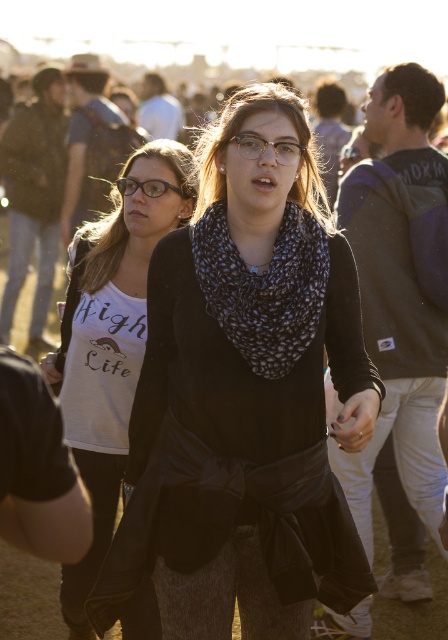
Question: Which object is farther from the camera taking this photo?

Choices:
 (A) black matte scarf at center
 (B) clear plastic glasses at center
 (C) matte black glasses at center

Answer: (C)

Question: Which of the following is the closest to the observer?

Choices:
 (A) (302, 148)
 (B) (120, 464)
 (C) (244, 352)
 (D) (177, 192)

Answer: (C)

Question: Which point is farther to the camera?

Choices:
 (A) (121, 184)
 (B) (271, 314)

Answer: (A)

Question: Can you confirm if black dotted scarf at center is thinner than matte black glasses at center?

Choices:
 (A) no
 (B) yes

Answer: (A)

Question: Is black dotted scarf at center smaller than clear plastic glasses at center?

Choices:
 (A) no
 (B) yes

Answer: (A)

Question: In this image, where is white matte t-shirt at center located relative to clear plastic glasses at center?

Choices:
 (A) right
 (B) left

Answer: (B)